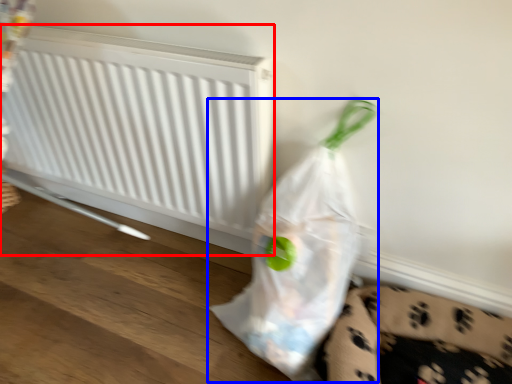
Question: Which point is closer to the camera, radiator (highlighted by a red box) or plastic bag (highlighted by a blue box)?

Choices:
 (A) radiator
 (B) plastic bag

Answer: (B)